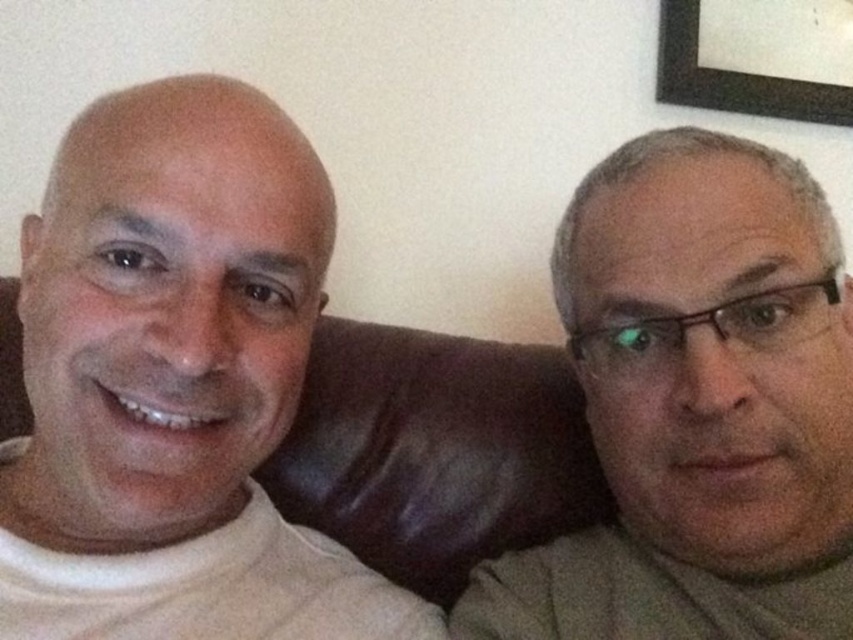
Question: Which point is farther to the camera?

Choices:
 (A) gray matte glasses at right
 (B) white matte t-shirt at left
 (C) black matte picture frame at upper right

Answer: (C)

Question: Which is farther from the black matte picture frame at upper right?

Choices:
 (A) gray matte glasses at right
 (B) white matte t-shirt at left

Answer: (B)

Question: Can you confirm if white matte t-shirt at left is positioned below black matte picture frame at upper right?

Choices:
 (A) yes
 (B) no

Answer: (A)

Question: Can you confirm if white matte t-shirt at left is positioned to the right of black matte picture frame at upper right?

Choices:
 (A) yes
 (B) no

Answer: (B)

Question: Among these objects, which one is farthest from the camera?

Choices:
 (A) black matte picture frame at upper right
 (B) white matte t-shirt at left

Answer: (A)

Question: Does gray matte glasses at right have a larger size compared to black matte picture frame at upper right?

Choices:
 (A) yes
 (B) no

Answer: (A)